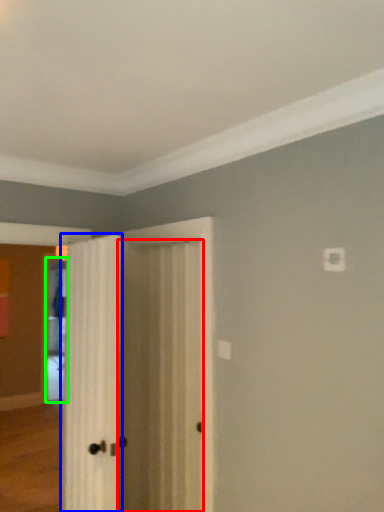
Question: Considering the real-world distances, which object is farthest from door (highlighted by a red box)? door (highlighted by a blue box) or screen door (highlighted by a green box)?

Choices:
 (A) door
 (B) screen door

Answer: (B)